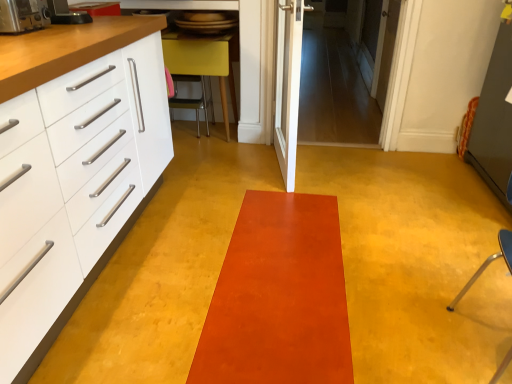
Question: From the image's perspective, does satin orange mat at center appear higher than metallic silver toaster at left, positioned as the 1th appliance in front-to-back order?

Choices:
 (A) yes
 (B) no

Answer: (B)

Question: Are satin orange mat at center and metallic silver toaster at left, positioned as the 1th appliance in front-to-back order, making contact?

Choices:
 (A) no
 (B) yes

Answer: (A)

Question: Does satin orange mat at center have a greater width compared to metallic silver toaster at left, positioned as the 1th appliance in front-to-back order?

Choices:
 (A) yes
 (B) no

Answer: (A)

Question: Is satin orange mat at center outside metallic silver toaster at left, the 2th appliance from the back?

Choices:
 (A) yes
 (B) no

Answer: (A)

Question: Is satin orange mat at center turned away from metallic silver toaster at left, positioned as the 1th appliance in front-to-back order?

Choices:
 (A) no
 (B) yes

Answer: (A)

Question: Considering the positions of matte yellow chair at center, which is the second furniture from bottom to top, and metallic silver chair at center in the image, is matte yellow chair at center, which is the second furniture from bottom to top, bigger or smaller than metallic silver chair at center?

Choices:
 (A) big
 (B) small

Answer: (A)

Question: In terms of width, does matte yellow chair at center, acting as the 1th furniture starting from the left, look wider or thinner when compared to metallic silver chair at center?

Choices:
 (A) thin
 (B) wide

Answer: (B)

Question: Relative to metallic silver chair at center, is matte yellow chair at center, the 2th furniture viewed from the front, in front or behind?

Choices:
 (A) front
 (B) behind

Answer: (A)

Question: From the image's perspective, is matte yellow chair at center, acting as the 1th furniture starting from the left, above or below metallic silver chair at center?

Choices:
 (A) below
 (B) above

Answer: (B)

Question: Considering the positions of point (509, 266) and point (287, 183), is point (509, 266) closer or farther from the camera than point (287, 183)?

Choices:
 (A) farther
 (B) closer

Answer: (B)

Question: From the image's perspective, is blue plastic chair at right, which is the 1th furniture from right to left, positioned above or below white glossy door at center, placed as the second door when sorted from back to front?

Choices:
 (A) above
 (B) below

Answer: (B)

Question: Is blue plastic chair at right, the second furniture viewed from the back, in front of or behind white glossy door at center, the first door in the front-to-back sequence, in the image?

Choices:
 (A) behind
 (B) front

Answer: (B)

Question: Is blue plastic chair at right, which is counted as the second furniture, starting from the left, bigger or smaller than white glossy door at center, the first door in the front-to-back sequence?

Choices:
 (A) big
 (B) small

Answer: (B)

Question: From a real-world perspective, relative to white wooden door at upper right, the second door from the front, is satin orange mat at center vertically above or below?

Choices:
 (A) above
 (B) below

Answer: (B)

Question: Considering the positions of satin orange mat at center and white wooden door at upper right, which appears as the first door when viewed from the back, in the image, is satin orange mat at center taller or shorter than white wooden door at upper right, which appears as the first door when viewed from the back,?

Choices:
 (A) tall
 (B) short

Answer: (B)